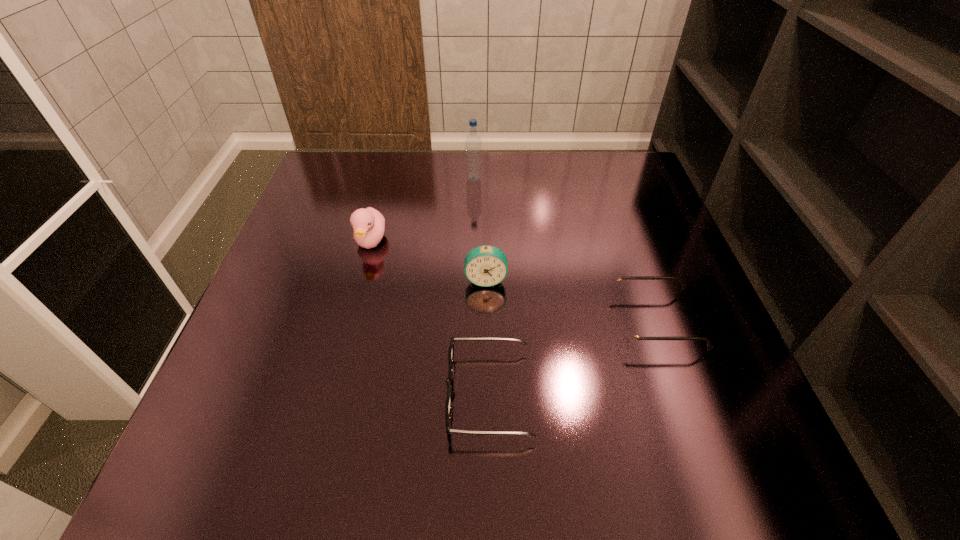
Where is `free space located at the hinge ends of the right spectacles`? The height and width of the screenshot is (540, 960). free space located at the hinge ends of the right spectacles is located at coordinates (581, 321).

I want to click on vacant space positioned 0.360m at the hinge ends of the right spectacles, so click(434, 321).

This screenshot has width=960, height=540. In order to click on vacant region located at the hinge ends of the right spectacles in this screenshot , I will do `click(440, 321)`.

The height and width of the screenshot is (540, 960). Identify the location of vacant space located on the front-facing side of the left spectacles. (296, 394).

Identify the location of vacant space located 0.290m on the front-facing side of the left spectacles. This screenshot has width=960, height=540. [278, 394].

Image resolution: width=960 pixels, height=540 pixels. Find the location of `vacant area located on the front-facing side of the left spectacles`. vacant area located on the front-facing side of the left spectacles is located at coordinates (244, 394).

Locate an element on the screen. The width and height of the screenshot is (960, 540). object at the far edge is located at coordinates (473, 142).

Where is `object located in the near edge section of the desktop`? object located in the near edge section of the desktop is located at coordinates (448, 405).

Identify the location of object located at the right edge. (630, 333).

This screenshot has height=540, width=960. I want to click on vacant space at the far edge of the desktop, so click(x=402, y=163).